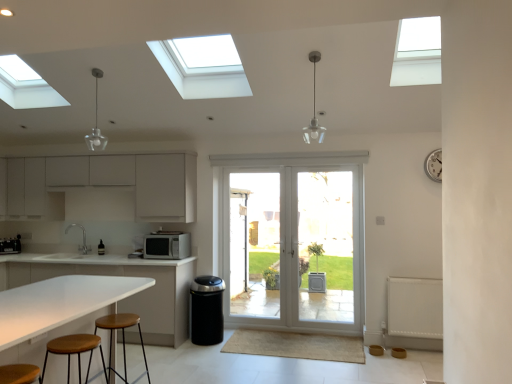
Describe the element at coordinates (108, 182) in the screenshot. I see `white matte cabinets at left, the first cabinetry from the top` at that location.

The width and height of the screenshot is (512, 384). What do you see at coordinates (119, 275) in the screenshot?
I see `white matte countertop at left, arranged as the second cabinetry when viewed from the top` at bounding box center [119, 275].

What do you see at coordinates (59, 303) in the screenshot? I see `white laminate table at lower left` at bounding box center [59, 303].

This screenshot has height=384, width=512. What are the coordinates of `satin nickel faucet at center` in the screenshot? It's located at (82, 238).

Identify the location of brown wood stool at lower left, arranged as the 2th stool when viewed from the back. (75, 351).

The image size is (512, 384). I want to click on clear glass door at center, so click(x=325, y=246).

In the image, there is a white matte microwave at center, the 1th appliance when ordered from right to left. Identify the location of cabinetry below it (from a real-world perspective). (119, 275).

Which object is thinner, white matte countertop at left, marked as the 1th cabinetry in a bottom-to-top arrangement, or white matte microwave at center, placed as the 2th appliance when sorted from back to front?

white matte microwave at center, placed as the 2th appliance when sorted from back to front, is thinner.

Is there a large distance between white matte countertop at left, arranged as the second cabinetry when viewed from the top, and white matte microwave at center, the first appliance positioned from the front?

white matte countertop at left, arranged as the second cabinetry when viewed from the top, is near white matte microwave at center, the first appliance positioned from the front, not far away.

Would you say brown wood stool at lower left, which ranks as the 1th stool in front-to-back order, contains white matte cabinets at left, acting as the second cabinetry starting from the bottom?

Definitely not — white matte cabinets at left, acting as the second cabinetry starting from the bottom, is not inside brown wood stool at lower left, which ranks as the 1th stool in front-to-back order.

Who is shorter, brown wood stool at lower left, arranged as the 2th stool when viewed from the back, or white matte cabinets at left, acting as the second cabinetry starting from the bottom?

Standing shorter between the two is brown wood stool at lower left, arranged as the 2th stool when viewed from the back.

Is brown wood stool at lower left, which ranks as the 1th stool in front-to-back order, bigger than white matte cabinets at left, acting as the second cabinetry starting from the bottom?

No.

Is brown wood stool at lower left, which ranks as the 1th stool in front-to-back order, with white matte cabinets at left, the first cabinetry from the top?

No, brown wood stool at lower left, which ranks as the 1th stool in front-to-back order, is not beside white matte cabinets at left, the first cabinetry from the top.

From a real-world perspective, who is located lower, white matte countertop at left, marked as the 1th cabinetry in a bottom-to-top arrangement, or brown wood stool at lower left, which ranks as the 1th stool in front-to-back order?

From a 3D spatial view, white matte countertop at left, marked as the 1th cabinetry in a bottom-to-top arrangement, is below.

From the picture: Is white matte countertop at left, arranged as the second cabinetry when viewed from the top, further to the viewer compared to brown wood stool at lower left, which ranks as the 1th stool in front-to-back order?

Yes, white matte countertop at left, arranged as the second cabinetry when viewed from the top, is behind brown wood stool at lower left, which ranks as the 1th stool in front-to-back order.

From the image's perspective, is white matte countertop at left, arranged as the second cabinetry when viewed from the top, located above or below brown wood stool at lower left, which ranks as the 1th stool in front-to-back order?

white matte countertop at left, arranged as the second cabinetry when viewed from the top, is situated lower than brown wood stool at lower left, which ranks as the 1th stool in front-to-back order, in the image.

Which of these two, white matte countertop at left, marked as the 1th cabinetry in a bottom-to-top arrangement, or brown wood stool at lower left, which ranks as the 1th stool in front-to-back order, is smaller?

brown wood stool at lower left, which ranks as the 1th stool in front-to-back order.

In the scene shown: Considering the sizes of objects white matte countertop at left, arranged as the second cabinetry when viewed from the top, and satin black microwave at left, acting as the first appliance starting from the left, in the image provided, who is taller, white matte countertop at left, arranged as the second cabinetry when viewed from the top, or satin black microwave at left, acting as the first appliance starting from the left,?

Standing taller between the two is white matte countertop at left, arranged as the second cabinetry when viewed from the top.

Looking at this image, is white matte countertop at left, marked as the 1th cabinetry in a bottom-to-top arrangement, far from satin black microwave at left, arranged as the second appliance when viewed from the right?

Yes, white matte countertop at left, marked as the 1th cabinetry in a bottom-to-top arrangement, and satin black microwave at left, arranged as the second appliance when viewed from the right, are located far from each other.

From a real-world perspective, is white matte countertop at left, arranged as the second cabinetry when viewed from the top, on top of satin black microwave at left, marked as the second appliance in a front-to-back arrangement?

No, from a real-world perspective, white matte countertop at left, arranged as the second cabinetry when viewed from the top, is not on top of satin black microwave at left, marked as the second appliance in a front-to-back arrangement.

Is white matte countertop at left, marked as the 1th cabinetry in a bottom-to-top arrangement, wider than satin black microwave at left, acting as the first appliance starting from the left?

Yes, white matte countertop at left, marked as the 1th cabinetry in a bottom-to-top arrangement, is wider than satin black microwave at left, acting as the first appliance starting from the left.

How much distance is there between clear glass door at center and matte silver pendant light at upper left?

clear glass door at center is 9.86 feet away from matte silver pendant light at upper left.

Is clear glass door at center not near matte silver pendant light at upper left?

Yes, clear glass door at center and matte silver pendant light at upper left are quite far apart.

In the scene shown: Between clear glass door at center and matte silver pendant light at upper left, which one has less height?

Standing shorter between the two is matte silver pendant light at upper left.

From a real-world perspective, is white matte cabinets at left, the first cabinetry from the top, located beneath satin nickel faucet at center?

Actually, white matte cabinets at left, the first cabinetry from the top, is physically above satin nickel faucet at center in the real world.

In the image, there is a white matte cabinets at left, the first cabinetry from the top. Where is `sink below it (from a real-world perspective)`? Image resolution: width=512 pixels, height=384 pixels. sink below it (from a real-world perspective) is located at coordinates (82, 238).

Is white matte cabinets at left, the first cabinetry from the top, taller or shorter than satin nickel faucet at center?

Considering their sizes, white matte cabinets at left, the first cabinetry from the top, has more height than satin nickel faucet at center.

From a real-world perspective, is white matte countertop at left, arranged as the second cabinetry when viewed from the top, physically located above or below clear glass door at center?

white matte countertop at left, arranged as the second cabinetry when viewed from the top, is below clear glass door at center.

Does white matte countertop at left, marked as the 1th cabinetry in a bottom-to-top arrangement, have a smaller size compared to clear glass door at center?

Incorrect, white matte countertop at left, marked as the 1th cabinetry in a bottom-to-top arrangement, is not smaller in size than clear glass door at center.

Can you confirm if white matte countertop at left, arranged as the second cabinetry when viewed from the top, is taller than clear glass door at center?

Incorrect, the height of white matte countertop at left, arranged as the second cabinetry when viewed from the top, is not larger of that of clear glass door at center.

Looking at this image, can clear glass door at center be found inside white matte countertop at left, marked as the 1th cabinetry in a bottom-to-top arrangement?

No, white matte countertop at left, marked as the 1th cabinetry in a bottom-to-top arrangement, does not contain clear glass door at center.

You are a GUI agent. You are given a task and a screenshot of the screen. Output one action in this format:
    pyautogui.click(x=<x>, y=<y>)
    Task: Click on the 1st appliance behind the white matte countertop at left, arranged as the second cabinetry when viewed from the top, counting from the anchor's position
    Image resolution: width=512 pixels, height=384 pixels.
    Given the screenshot: What is the action you would take?
    pos(167,245)

You are a GUI agent. You are given a task and a screenshot of the screen. Output one action in this format:
    pyautogui.click(x=<x>, y=<y>)
    Task: Click on the cabinetry above the brown wood stool at lower left, arranged as the 2th stool when viewed from the back (from a real-world perspective)
    The height and width of the screenshot is (384, 512).
    Given the screenshot: What is the action you would take?
    pyautogui.click(x=108, y=182)

Based on their spatial positions, is white glossy door at center or white textured radiator at lower right closer to white matte microwave at center, the 1th appliance when ordered from right to left?

white glossy door at center.

Based on their spatial positions, is white laminate table at lower left or white textured radiator at lower right further from white matte cabinets at left, acting as the second cabinetry starting from the bottom?

The object further to white matte cabinets at left, acting as the second cabinetry starting from the bottom, is white textured radiator at lower right.

Based on their spatial positions, is clear glass door at center or brown wood stool at lower left, arranged as the 2th stool when viewed from the back, closer to clear glass door at center?

clear glass door at center is positioned closer to the anchor clear glass door at center.

Which object lies nearer to the anchor point white matte microwave at center, the first appliance positioned from the front, matte silver pendant light at upper left or white matte countertop at left, arranged as the second cabinetry when viewed from the top?

white matte countertop at left, arranged as the second cabinetry when viewed from the top.

Looking at the image, which one is located further to white metallic clock at upper right, white laminate table at lower left or clear glass door at center?

white laminate table at lower left is positioned further to the anchor white metallic clock at upper right.

Which object lies nearer to the anchor point brown wooden stool at lower left, arranged as the 2th stool when viewed from the front, white metallic clock at upper right or brown wood stool at lower left, arranged as the 2th stool when viewed from the back?

brown wood stool at lower left, arranged as the 2th stool when viewed from the back, lies closer to brown wooden stool at lower left, arranged as the 2th stool when viewed from the front, than the other object.

Considering their positions, is white textured radiator at lower right positioned further to satin nickel faucet at center than matte silver pendant light at upper left?

Among the two, white textured radiator at lower right is located further to satin nickel faucet at center.

Estimate the real-world distances between objects in this image. Which object is closer to satin black microwave at left, the 1th appliance positioned from the back, white textured radiator at lower right or white glossy door at center?

white glossy door at center is closer to satin black microwave at left, the 1th appliance positioned from the back.

Identify the location of cabinetry positioned between white laminate table at lower left and white matte cabinets at left, the first cabinetry from the top, from near to far. Image resolution: width=512 pixels, height=384 pixels. (119, 275).

This screenshot has height=384, width=512. I want to click on cabinetry between white matte countertop at left, marked as the 1th cabinetry in a bottom-to-top arrangement, and clear glass door at center from left to right, so click(108, 182).

Find the location of a particular element. window screen between satin nickel faucet at center and white metallic clock at upper right is located at coordinates (325, 246).

Identify the location of screen door between matte silver pendant light at upper left and white metallic clock at upper right in the horizontal direction. This screenshot has width=512, height=384. (255, 244).